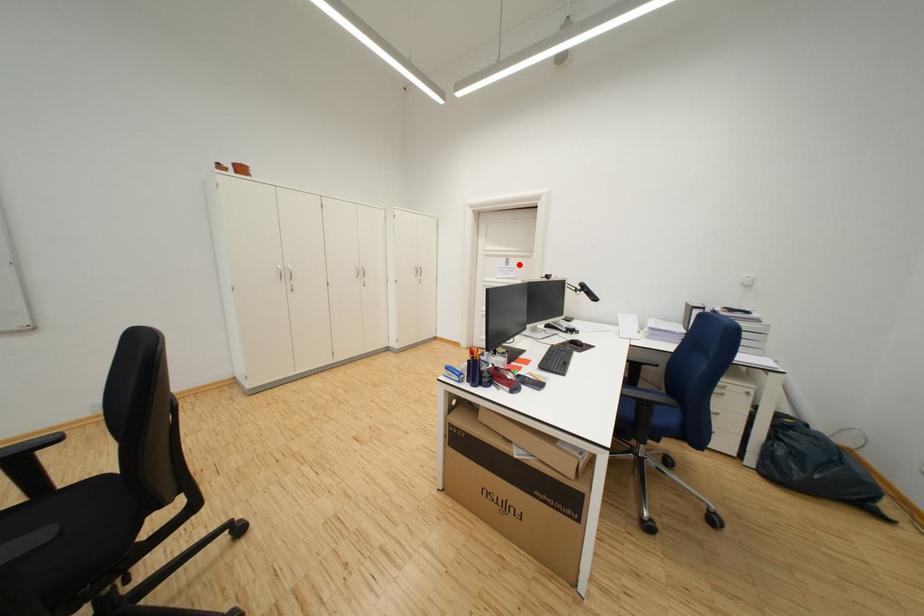
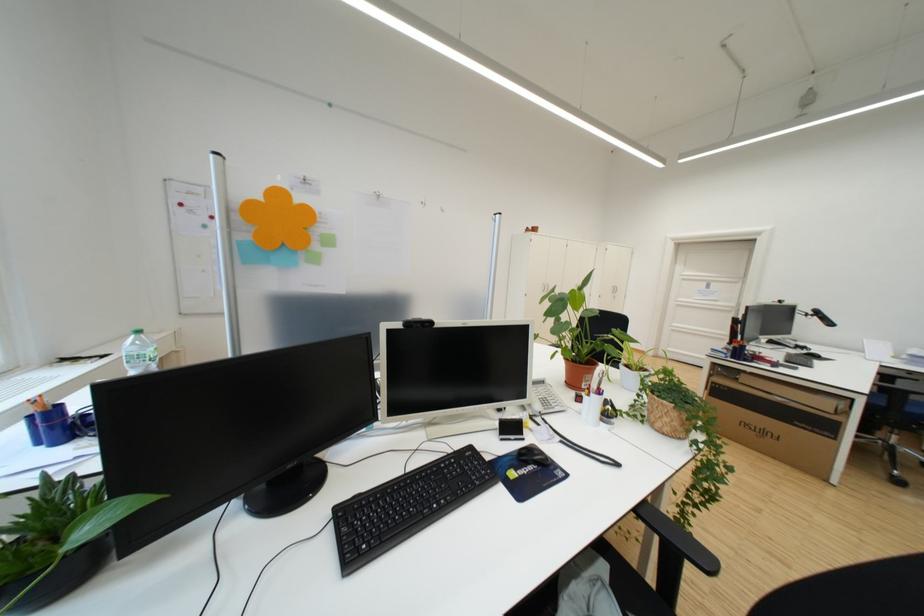
Question: I am providing you with two images of the same scene from different viewpoints. A red point is shown in image1. For the corresponding object point in image2, is it positioned nearer or farther from the camera?

Choices:
 (A) Nearer
 (B) Farther

Answer: (B)